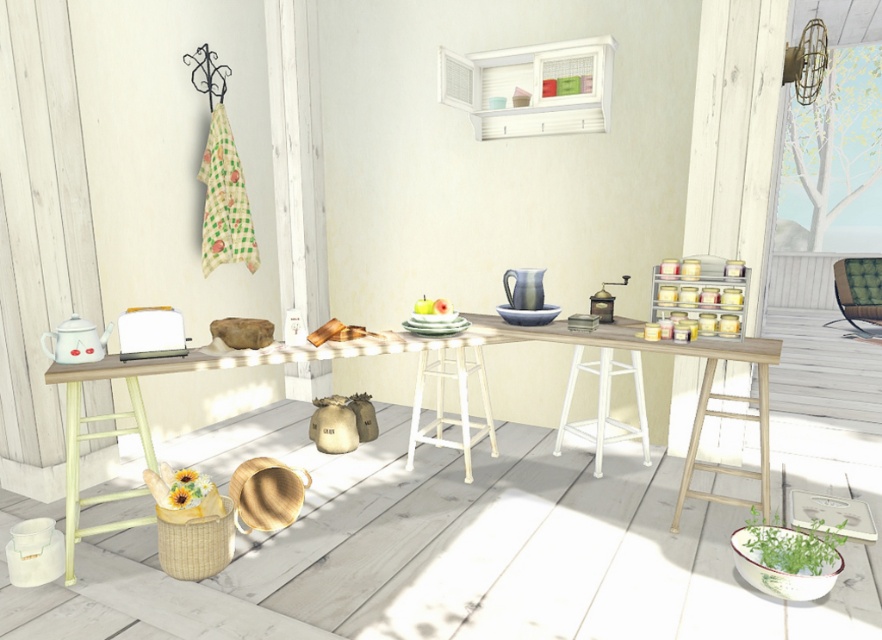
Can you confirm if wooden table at left is positioned to the left of green fabric chair at right?

Correct, you'll find wooden table at left to the left of green fabric chair at right.

Which is more to the right, wooden table at left or green fabric chair at right?

Positioned to the right is green fabric chair at right.

Which is behind, point (629, 339) or point (860, 275)?

The point (860, 275) is more distant.

Find the location of a particular element. The image size is (882, 640). wooden table at left is located at coordinates (699, 392).

Measure the distance between point (602, 384) and camera.

Point (602, 384) is 3.60 meters away from camera.

Is white wooden stool at center below green fabric chair at right?

Yes, white wooden stool at center is below green fabric chair at right.

Who is more distant from viewer, [608,400] or [848,320]?

The point [848,320] is more distant.

This screenshot has height=640, width=882. What are the coordinates of `white wooden stool at center` in the screenshot? It's located at (604, 404).

Between wooden table at left and white wooden stool at center, which one is positioned higher?

Positioned higher is wooden table at left.

Where is `wooden table at left`? The image size is (882, 640). wooden table at left is located at coordinates (699, 392).

Where is `wooden table at left`? wooden table at left is located at coordinates (699, 392).

Locate an element on the screen. Image resolution: width=882 pixels, height=640 pixels. wooden table at left is located at coordinates (699, 392).